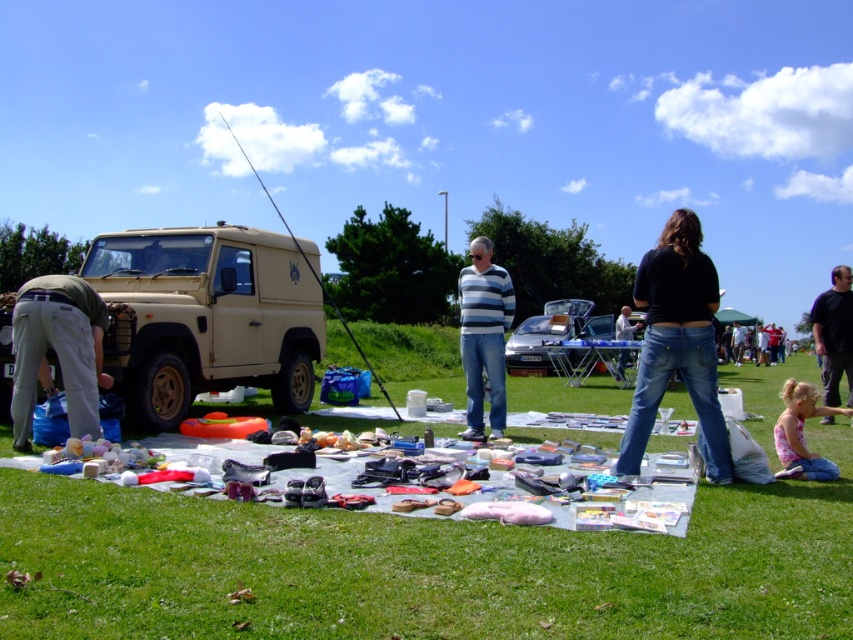
You are standing at the edge of the grassy field and want to pick up both the green cotton pants at lower left and the denim jeans at center. Given that you can only carry one item at a time, which item should you pick up first to minimize the total distance you walk?

The green cotton pants at lower left is 14.74 meters away from the denim jeans at center. To minimize the total distance walked, you should pick up the item closer to your starting position first. However, since the exact distance from the starting point to each item isn

You are standing at the edge of the grassy field and see the green grass at lower center and the green cotton pants at lower left. Which object is positioned lower in the image?

The green grass at lower center is below the green cotton pants at lower left, so the green grass at lower center is positioned lower in the image.